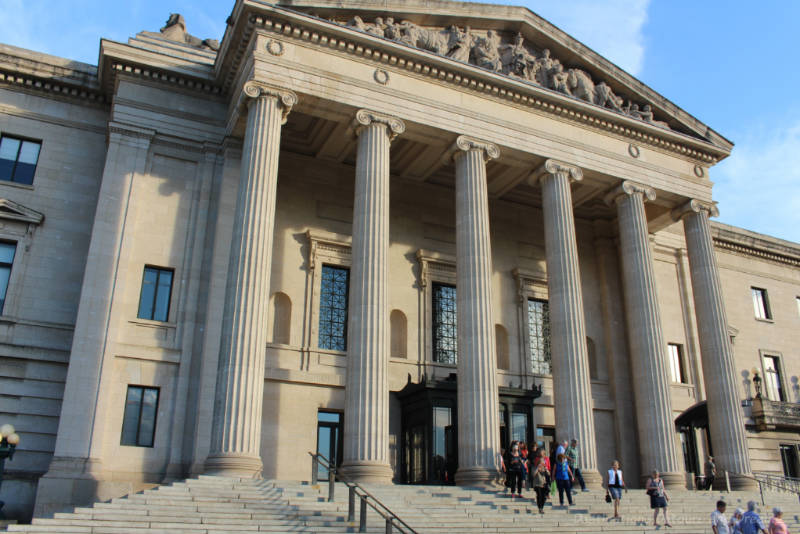
The width and height of the screenshot is (800, 534). I want to click on window, so click(x=152, y=295), click(x=140, y=407), click(x=6, y=151), click(x=32, y=153), click(x=758, y=302), click(x=674, y=368), click(x=778, y=380), click(x=330, y=286), click(x=449, y=313), click(x=530, y=329).